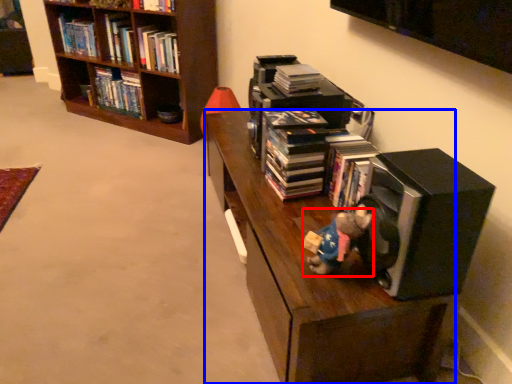
Question: Which object appears farthest to the camera in this image, figurine (highlighted by a red box) or shelf (highlighted by a blue box)?

Choices:
 (A) figurine
 (B) shelf

Answer: (B)